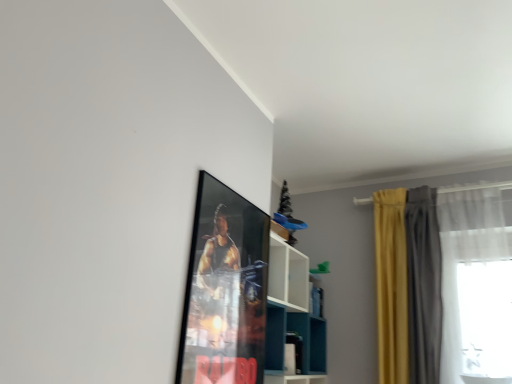
This screenshot has height=384, width=512. Describe the element at coordinates (391, 285) in the screenshot. I see `yellow fabric curtain at right, the third curtain viewed from the right` at that location.

You are a GUI agent. You are given a task and a screenshot of the screen. Output one action in this format:
    pyautogui.click(x=<x>, y=<y>)
    Task: Click on the yellow velvet curtains at right, which is counted as the second curtain, starting from the left
    The height and width of the screenshot is (384, 512).
    Given the screenshot: What is the action you would take?
    pyautogui.click(x=423, y=285)

Identify the location of white glossy shelf at upper center. Image resolution: width=512 pixels, height=384 pixels. (292, 311).

The height and width of the screenshot is (384, 512). Identify the location of metallic poster at upper center. [x=225, y=290].

Where is `picture frame on the left of yellow velvet curtains at right, which is counted as the second curtain, starting from the left`? The height and width of the screenshot is (384, 512). picture frame on the left of yellow velvet curtains at right, which is counted as the second curtain, starting from the left is located at coordinates (225, 290).

Could you measure the distance between yellow velvet curtains at right, which is counted as the second curtain, starting from the left, and metallic poster at upper center?

yellow velvet curtains at right, which is counted as the second curtain, starting from the left, is 4.31 feet away from metallic poster at upper center.

Can you confirm if yellow velvet curtains at right, which is counted as the second curtain, starting from the left, is positioned to the left of metallic poster at upper center?

No, yellow velvet curtains at right, which is counted as the second curtain, starting from the left, is not to the left of metallic poster at upper center.

From the image's perspective, relative to metallic poster at upper center, is yellow velvet curtains at right, which is counted as the second curtain, starting from the left, above or below?

yellow velvet curtains at right, which is counted as the second curtain, starting from the left, is below metallic poster at upper center.

In the scene shown: From the image's perspective, is white glossy shelf at upper center above metallic poster at upper center?

No, from the image's perspective, white glossy shelf at upper center is not over metallic poster at upper center.

Which is more to the left, white glossy shelf at upper center or metallic poster at upper center?

Positioned to the left is metallic poster at upper center.

Which point is more forward, (302,329) or (215,328)?

The point (215,328) is closer.

Considering the sizes of objects white glossy shelf at upper center and metallic poster at upper center in the image provided, who is smaller, white glossy shelf at upper center or metallic poster at upper center?

metallic poster at upper center is smaller.

From the image's perspective, does yellow fabric curtain at right, the third curtain viewed from the right, appear lower than white sheer curtain at right, which ranks as the first curtain in right-to-left order?

Yes.

Who is more distant, yellow fabric curtain at right, positioned as the first curtain in left-to-right order, or white sheer curtain at right, marked as the 3th curtain in a left-to-right arrangement?

yellow fabric curtain at right, positioned as the first curtain in left-to-right order, is behind.

Looking at this image, in the image, is yellow fabric curtain at right, positioned as the first curtain in left-to-right order, on the left side or the right side of white sheer curtain at right, which ranks as the first curtain in right-to-left order?

Clearly, yellow fabric curtain at right, positioned as the first curtain in left-to-right order, is on the left of white sheer curtain at right, which ranks as the first curtain in right-to-left order, in the image.

From the image's perspective, which is above, white sheer curtain at right, marked as the 3th curtain in a left-to-right arrangement, or metallic poster at upper center?

metallic poster at upper center appears higher in the image.

Does white sheer curtain at right, marked as the 3th curtain in a left-to-right arrangement, appear on the left side of metallic poster at upper center?

No.

Looking at this image, is white sheer curtain at right, which ranks as the first curtain in right-to-left order, in front of or behind metallic poster at upper center in the image?

Visually, white sheer curtain at right, which ranks as the first curtain in right-to-left order, is located behind metallic poster at upper center.

Considering the relative sizes of white sheer curtain at right, which ranks as the first curtain in right-to-left order, and metallic poster at upper center in the image provided, is white sheer curtain at right, which ranks as the first curtain in right-to-left order, bigger than metallic poster at upper center?

Yes, white sheer curtain at right, which ranks as the first curtain in right-to-left order, is bigger than metallic poster at upper center.

Are white glossy shelf at upper center and yellow fabric curtain at right, the third curtain viewed from the right, making contact?

They are not placed beside each other.

From a real-world perspective, is white glossy shelf at upper center physically located above or below yellow fabric curtain at right, the third curtain viewed from the right?

From a real-world perspective, white glossy shelf at upper center is physically below yellow fabric curtain at right, the third curtain viewed from the right.

Based on the photo, is white glossy shelf at upper center facing away from yellow fabric curtain at right, positioned as the first curtain in left-to-right order?

No.

Considering the sizes of objects white glossy shelf at upper center and yellow fabric curtain at right, positioned as the first curtain in left-to-right order, in the image provided, who is taller, white glossy shelf at upper center or yellow fabric curtain at right, positioned as the first curtain in left-to-right order,?

yellow fabric curtain at right, positioned as the first curtain in left-to-right order.

Locate an element on the screen. the 2nd curtain directly above the white glossy shelf at upper center (from a real-world perspective) is located at coordinates [x=423, y=285].

From a real-world perspective, is yellow velvet curtains at right, which is counted as the second curtain, starting from the left, physically below white glossy shelf at upper center?

No, from a real-world perspective, yellow velvet curtains at right, which is counted as the second curtain, starting from the left, is not beneath white glossy shelf at upper center.

Considering the positions of points (426, 219) and (283, 368), is point (426, 219) farther from camera compared to point (283, 368)?

Yes, it is.

From a real-world perspective, who is located higher, yellow fabric curtain at right, the third curtain viewed from the right, or yellow velvet curtains at right, which is counted as the second curtain, starting from the left?

yellow velvet curtains at right, which is counted as the second curtain, starting from the left, is physically above.

Can you tell me how much yellow fabric curtain at right, positioned as the first curtain in left-to-right order, and yellow velvet curtains at right, which is the second curtain from right to left, differ in facing direction?

0.000401 degrees separate the facing orientations of yellow fabric curtain at right, positioned as the first curtain in left-to-right order, and yellow velvet curtains at right, which is the second curtain from right to left.

Is yellow fabric curtain at right, positioned as the first curtain in left-to-right order, in front of yellow velvet curtains at right, which is counted as the second curtain, starting from the left?

No, yellow fabric curtain at right, positioned as the first curtain in left-to-right order, is behind yellow velvet curtains at right, which is counted as the second curtain, starting from the left.

How much distance is there between yellow fabric curtain at right, the third curtain viewed from the right, and yellow velvet curtains at right, which is the second curtain from right to left?

yellow fabric curtain at right, the third curtain viewed from the right, is 4.35 inches away from yellow velvet curtains at right, which is the second curtain from right to left.

The image size is (512, 384). Find the location of `picture frame below the yellow velvet curtains at right, which is counted as the second curtain, starting from the left (from a real-world perspective)`. picture frame below the yellow velvet curtains at right, which is counted as the second curtain, starting from the left (from a real-world perspective) is located at coordinates pyautogui.click(x=225, y=290).

Where is `shelf located behind the metallic poster at upper center`? shelf located behind the metallic poster at upper center is located at coordinates (292, 311).

Considering their positions, is white sheer curtain at right, which ranks as the first curtain in right-to-left order, positioned closer to white glossy shelf at upper center than yellow fabric curtain at right, the third curtain viewed from the right?

yellow fabric curtain at right, the third curtain viewed from the right, lies closer to white glossy shelf at upper center than the other object.

From the image, which object appears to be farther from yellow velvet curtains at right, which is the second curtain from right to left, metallic poster at upper center or white glossy shelf at upper center?

Based on the image, metallic poster at upper center appears to be further to yellow velvet curtains at right, which is the second curtain from right to left.

Estimate the real-world distances between objects in this image. Which object is closer to white sheer curtain at right, marked as the 3th curtain in a left-to-right arrangement, yellow fabric curtain at right, positioned as the first curtain in left-to-right order, or yellow velvet curtains at right, which is counted as the second curtain, starting from the left?

yellow velvet curtains at right, which is counted as the second curtain, starting from the left.

When comparing their distances from white sheer curtain at right, which ranks as the first curtain in right-to-left order, does yellow velvet curtains at right, which is the second curtain from right to left, or metallic poster at upper center seem closer?

yellow velvet curtains at right, which is the second curtain from right to left.

Looking at the image, which one is located closer to metallic poster at upper center, yellow velvet curtains at right, which is the second curtain from right to left, or white glossy shelf at upper center?

The object closer to metallic poster at upper center is white glossy shelf at upper center.

Which object lies nearer to the anchor point yellow fabric curtain at right, positioned as the first curtain in left-to-right order, yellow velvet curtains at right, which is the second curtain from right to left, or metallic poster at upper center?

yellow velvet curtains at right, which is the second curtain from right to left, lies closer to yellow fabric curtain at right, positioned as the first curtain in left-to-right order, than the other object.

Considering their positions, is yellow fabric curtain at right, positioned as the first curtain in left-to-right order, positioned further to white sheer curtain at right, marked as the 3th curtain in a left-to-right arrangement, than white glossy shelf at upper center?

white glossy shelf at upper center lies further to white sheer curtain at right, marked as the 3th curtain in a left-to-right arrangement, than the other object.

Looking at the image, which one is located further to yellow fabric curtain at right, the third curtain viewed from the right, white sheer curtain at right, which ranks as the first curtain in right-to-left order, or white glossy shelf at upper center?

white glossy shelf at upper center lies further to yellow fabric curtain at right, the third curtain viewed from the right, than the other object.

This screenshot has width=512, height=384. I want to click on curtain situated between white glossy shelf at upper center and yellow velvet curtains at right, which is the second curtain from right to left, from left to right, so click(x=391, y=285).

I want to click on shelf between metallic poster at upper center and white sheer curtain at right, which ranks as the first curtain in right-to-left order, so click(292, 311).

Identify the location of shelf located between metallic poster at upper center and yellow fabric curtain at right, the third curtain viewed from the right, in the depth direction. This screenshot has height=384, width=512. (292, 311).

This screenshot has width=512, height=384. In order to click on curtain between metallic poster at upper center and yellow velvet curtains at right, which is the second curtain from right to left, from left to right in this screenshot , I will do `click(391, 285)`.